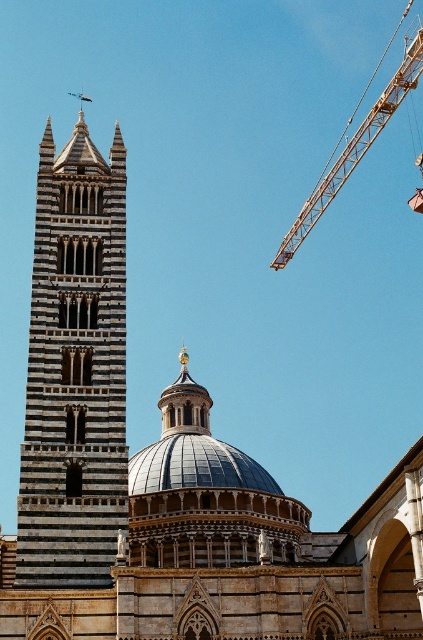
Question: Which point is farther to the camera?

Choices:
 (A) striped stone tower at left
 (B) metallic silver dome at center

Answer: (B)

Question: Can you confirm if striped stone dome at center is bigger than striped stone tower at left?

Choices:
 (A) yes
 (B) no

Answer: (B)

Question: Can you confirm if striped stone tower at left is positioned above orange metallic crane at upper right?

Choices:
 (A) yes
 (B) no

Answer: (B)

Question: Considering the relative positions of striped stone dome at center and orange metallic crane at upper right in the image provided, where is striped stone dome at center located with respect to orange metallic crane at upper right?

Choices:
 (A) above
 (B) below

Answer: (B)

Question: Which is farther from the metallic silver dome at center?

Choices:
 (A) striped stone dome at center
 (B) striped stone tower at left

Answer: (B)

Question: Which of these objects is positioned closest to the metallic silver dome at center?

Choices:
 (A) orange metallic crane at upper right
 (B) striped stone dome at center
 (C) striped stone tower at left

Answer: (B)